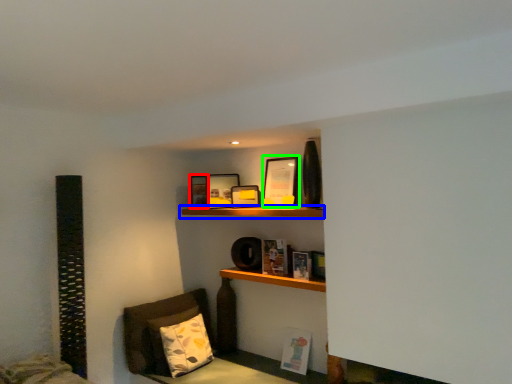
Question: Based on their relative distances, which object is farther from picture frame (highlighted by a red box)? Choose from shelf (highlighted by a blue box) and picture frame (highlighted by a green box).

Choices:
 (A) shelf
 (B) picture frame

Answer: (B)